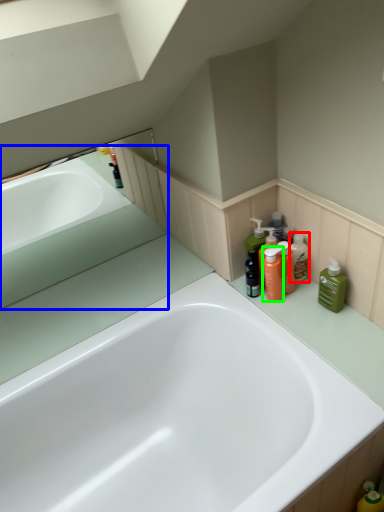
Question: Which object is positioned closest to mouthwash (highlighted by a red box)? Select from bath (highlighted by a blue box) and cleaning product (highlighted by a green box).

Choices:
 (A) bath
 (B) cleaning product

Answer: (B)